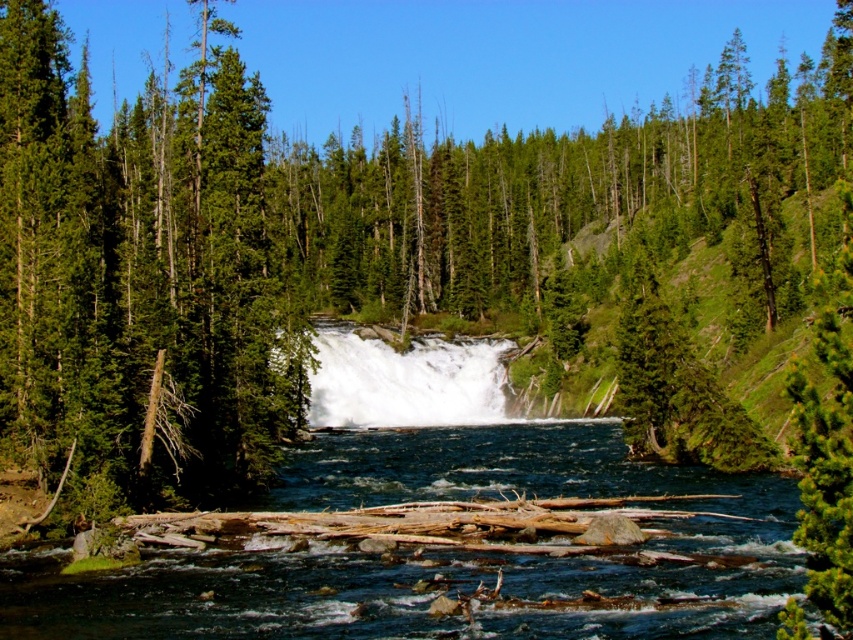
Does clear blue water at center appear on the left side of white frothy water at center?

In fact, clear blue water at center is to the right of white frothy water at center.

Between clear blue water at center and white frothy water at center, which one appears on the left side from the viewer's perspective?

white frothy water at center is more to the left.

Where is `clear blue water at center`? clear blue water at center is located at coordinates (440, 554).

Does point (67, 394) lie behind point (459, 404)?

That is False.

Can you confirm if green matte tree at left is positioned below clear blue water at center?

No.

Locate an element on the screen. The image size is (853, 640). green matte tree at left is located at coordinates (140, 275).

Describe the element at coordinates (140, 275) in the screenshot. This screenshot has width=853, height=640. I see `green matte tree at left` at that location.

Is green matte tree at left wider than white frothy water at center?

Yes, green matte tree at left is wider than white frothy water at center.

Who is more distant from viewer, (267,417) or (349,401)?

Point (349,401)

The height and width of the screenshot is (640, 853). Find the location of `green matte tree at left`. green matte tree at left is located at coordinates (140, 275).